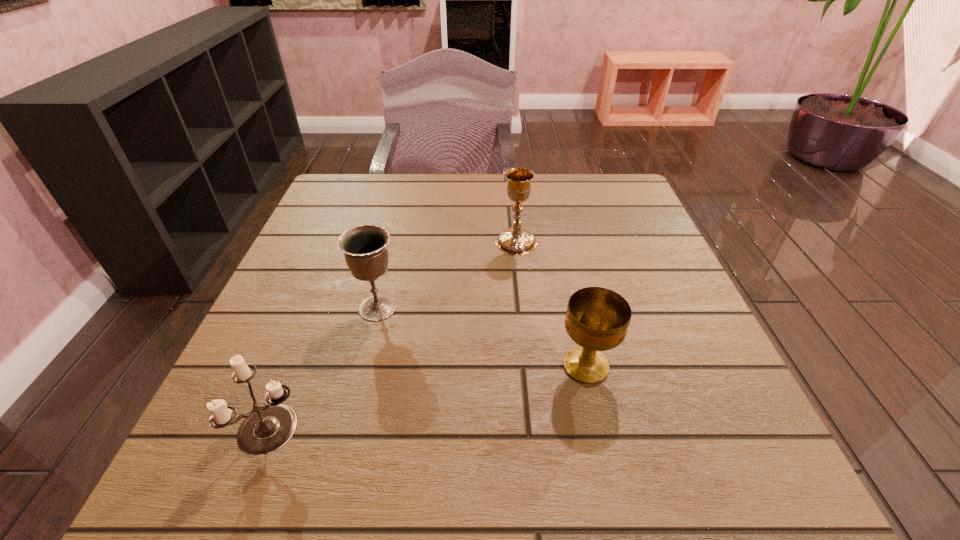
Locate an element on the screen. the farthest object is located at coordinates coord(516,241).

Locate an element on the screen. the farthest chalice is located at coordinates (516, 241).

At what (x,y) coordinates should I click in order to perform the action: click on the second nearest chalice. Please return your answer as a coordinate pair (x, y). Looking at the image, I should click on (365, 249).

Locate an element on the screen. The image size is (960, 540). the leftmost chalice is located at coordinates (365, 249).

At what (x,y) coordinates should I click in order to perform the action: click on the rightmost object. Please return your answer as a coordinate pair (x, y). Looking at the image, I should click on (597, 319).

The width and height of the screenshot is (960, 540). I want to click on the nearest chalice, so click(597, 319).

You are a GUI agent. You are given a task and a screenshot of the screen. Output one action in this format:
    pyautogui.click(x=<x>, y=<y>)
    Task: Click on the nearest object
    Image resolution: width=960 pixels, height=540 pixels.
    Given the screenshot: What is the action you would take?
    pyautogui.click(x=265, y=429)

Find the location of `the leftmost object`. the leftmost object is located at coordinates point(265,429).

The image size is (960, 540). Identify the location of vacant space located on the left of the farthest chalice. (409, 242).

Identify the location of free space located 0.160m on the left of the leftmost chalice. point(269,308).